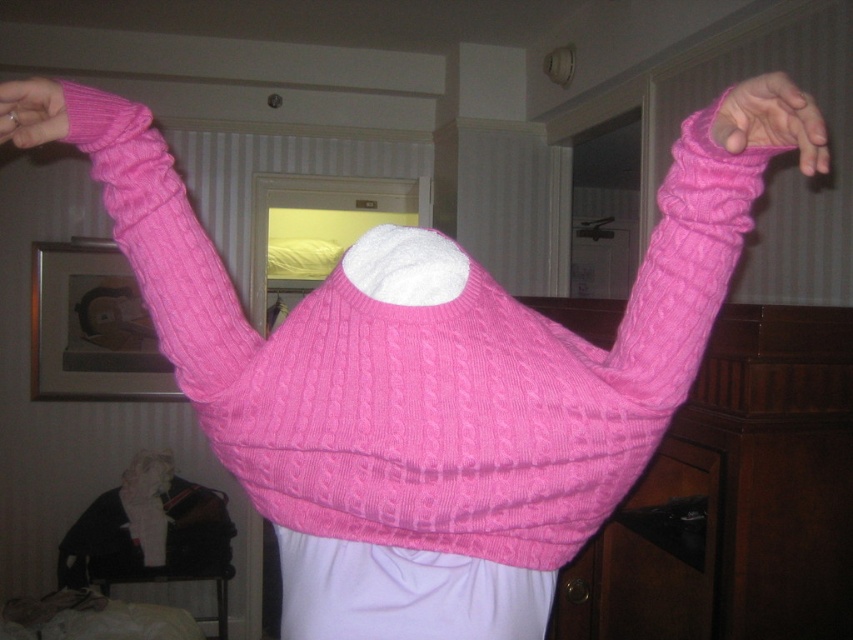
Question: Is cable-knit sweater at upper left smaller than matte pink sweater at upper left?

Choices:
 (A) yes
 (B) no

Answer: (B)

Question: Among these points, which one is nearest to the camera?

Choices:
 (A) (158, 348)
 (B) (49, 113)
 (C) (769, 128)

Answer: (C)

Question: Among these objects, which one is farthest from the camera?

Choices:
 (A) cable-knit sweater at upper left
 (B) matte pink sweater at upper left
 (C) pink knitted sweater at upper right

Answer: (A)

Question: Is cable-knit sweater at upper left to the right of pink knitted sweater at upper right from the viewer's perspective?

Choices:
 (A) no
 (B) yes

Answer: (A)

Question: Can you confirm if pink knitted sweater at upper right is positioned to the right of matte pink sweater at upper left?

Choices:
 (A) no
 (B) yes

Answer: (B)

Question: Which of the following is the closest to the observer?

Choices:
 (A) (798, 141)
 (B) (125, 198)
 (C) (51, 88)

Answer: (A)